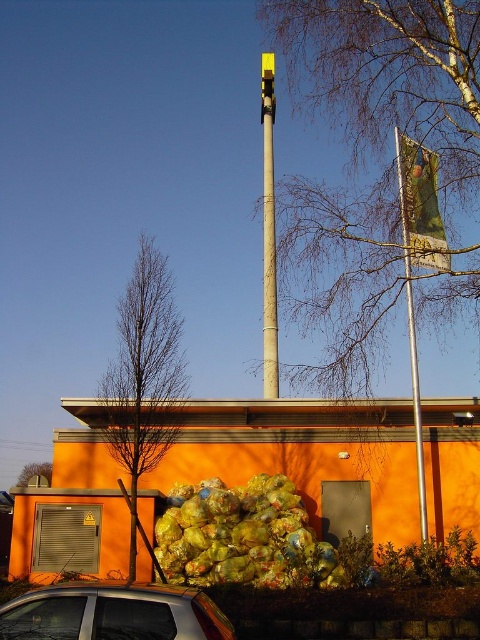
You are a delivery person who needs to park your satin silver car at lower left near the building. However, there is a bare branches at upper center in the way. Can you drive your car past the branches without hitting them?

The bare branches at upper center is much taller than the satin silver car at lower left, so you can drive your car past the branches without hitting them.